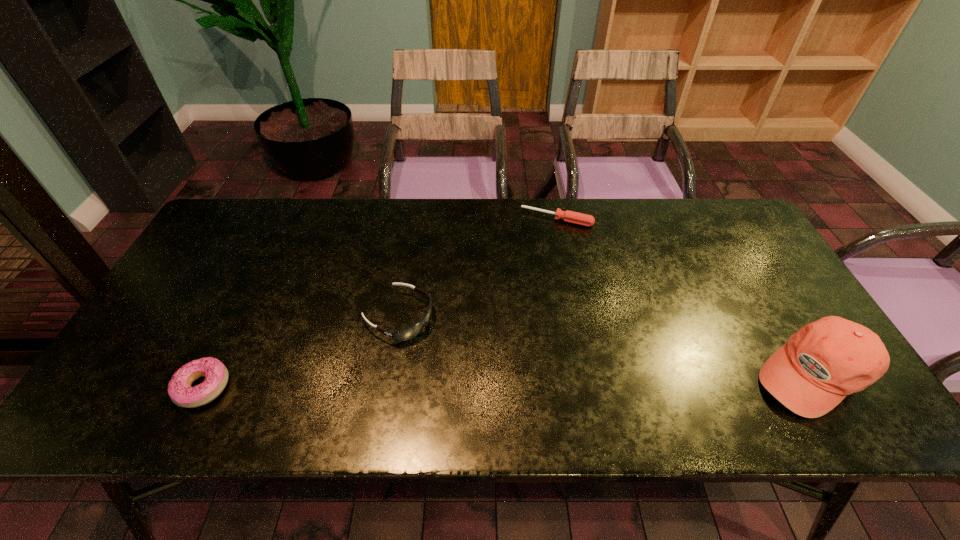
Identify the location of free space located 0.070m at the tip of the second object from right to left. (540, 242).

Locate an element on the screen. The width and height of the screenshot is (960, 540). free space located on the front and sides of the third object from right to left is located at coordinates (502, 370).

The height and width of the screenshot is (540, 960). I want to click on free region located on the front and sides of the third object from right to left, so click(x=510, y=374).

Locate an element on the screen. free location located on the front and sides of the third object from right to left is located at coordinates (443, 340).

Find the location of a particular element. This screenshot has width=960, height=540. object present at the far edge is located at coordinates (573, 217).

I want to click on doughnut that is at the near edge, so click(x=180, y=391).

Image resolution: width=960 pixels, height=540 pixels. Find the location of `baseball cap present at the near edge`. baseball cap present at the near edge is located at coordinates (826, 360).

Image resolution: width=960 pixels, height=540 pixels. I want to click on object located in the left edge section of the desktop, so click(x=180, y=391).

Find the location of a particular element. object positioned at the right edge is located at coordinates (826, 360).

Locate an element on the screen. object that is at the near left corner is located at coordinates (180, 391).